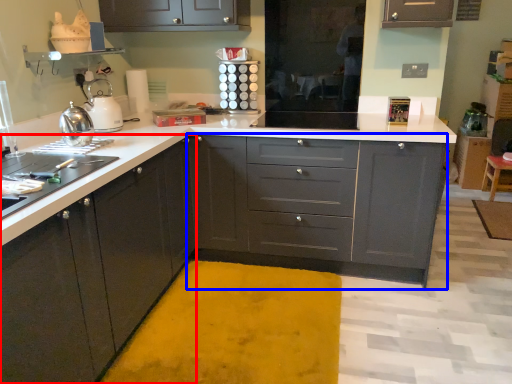
Question: Which object appears closest to the camera in this image, cabinetry (highlighted by a red box) or cabinetry (highlighted by a blue box)?

Choices:
 (A) cabinetry
 (B) cabinetry

Answer: (A)